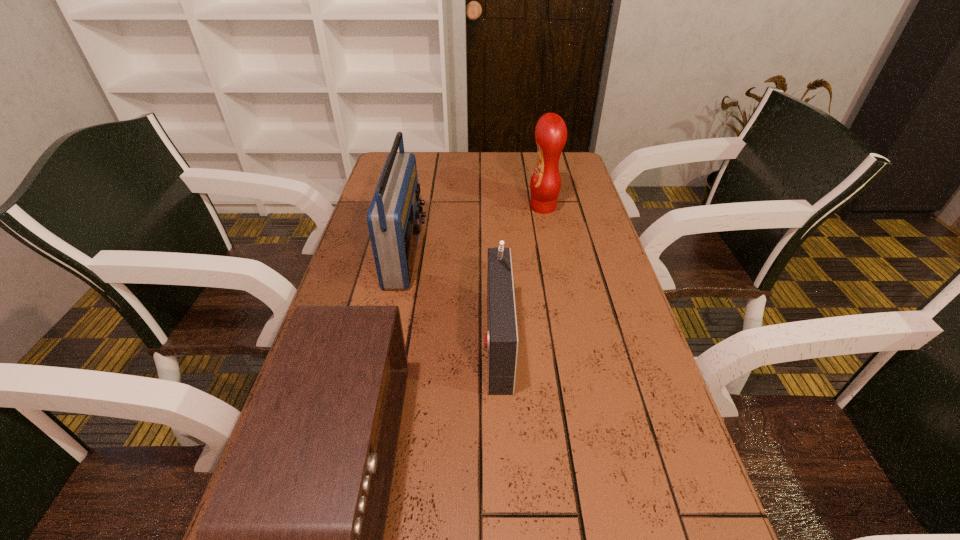
The height and width of the screenshot is (540, 960). In the image, there is a desktop. Find the location of `vacant space at the right edge`. vacant space at the right edge is located at coordinates (644, 407).

Locate an element on the screen. The height and width of the screenshot is (540, 960). free area in between the condiment and the third object from left to right is located at coordinates (520, 273).

The height and width of the screenshot is (540, 960). Find the location of `vacant point located between the third object from left to right and the rightmost object`. vacant point located between the third object from left to right and the rightmost object is located at coordinates (520, 273).

Locate an element on the screen. The image size is (960, 540). the closest object to the third object from left to right is located at coordinates (292, 539).

Locate which object ranks in proximity to the shortest object. Please provide its 2D coordinates. Your answer should be formatted as a tuple, i.e. [(x, y)], where the tuple contains the x and y coordinates of a point satisfying the conditions above.

[(501, 340)]

Identify which radio receiver is the second closest to the shortest radio receiver. Please provide its 2D coordinates. Your answer should be formatted as a tuple, i.e. [(x, y)], where the tuple contains the x and y coordinates of a point satisfying the conditions above.

[(394, 218)]

Image resolution: width=960 pixels, height=540 pixels. Identify the location of the third closest radio receiver to the rightmost object. (292, 539).